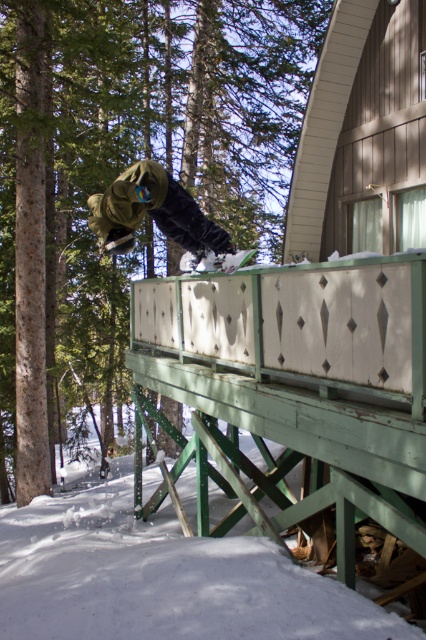
Looking at this image, does white fluffy snow at lower left have a larger size compared to white matte snowboard at center?

Yes, white fluffy snow at lower left is bigger than white matte snowboard at center.

Consider the image. Is white fluffy snow at lower left taller than white matte snowboard at center?

Yes, white fluffy snow at lower left is taller than white matte snowboard at center.

At what (x,y) coordinates should I click in order to perform the action: click on white fluffy snow at lower left. Please return your answer as a coordinate pair (x, y). Looking at the image, I should click on (163, 579).

Between point (175, 221) and point (250, 250), which one is positioned behind?

The point (250, 250) is behind.

Which is in front, point (216, 262) or point (215, 260)?

Point (216, 262)

Who is more forward, (199, 234) or (192, 253)?

Point (199, 234) is more forward.

At what (x,y) coordinates should I click in order to perform the action: click on green matte snowboarder at center. Please return your answer as a coordinate pair (x, y). The width and height of the screenshot is (426, 640). Looking at the image, I should click on (154, 212).

Does white fluffy snow at lower left appear over green matte snowboarder at center?

No, white fluffy snow at lower left is not above green matte snowboarder at center.

Is white fluffy snow at lower left thinner than green matte snowboarder at center?

Incorrect, white fluffy snow at lower left's width is not less than green matte snowboarder at center's.

The image size is (426, 640). I want to click on white fluffy snow at lower left, so click(163, 579).

This screenshot has height=640, width=426. Find the location of `white fluffy snow at lower left`. white fluffy snow at lower left is located at coordinates (163, 579).